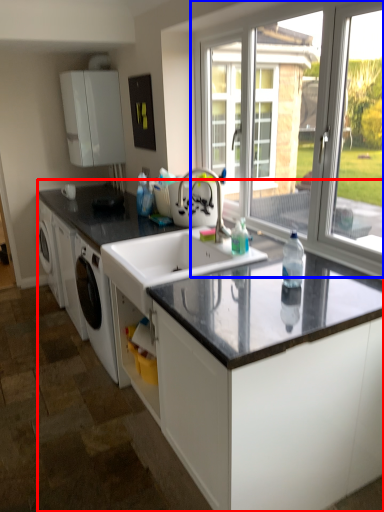
Question: Which of the following is the farthest to the observer, countertop (highlighted by a red box) or window (highlighted by a blue box)?

Choices:
 (A) countertop
 (B) window

Answer: (B)